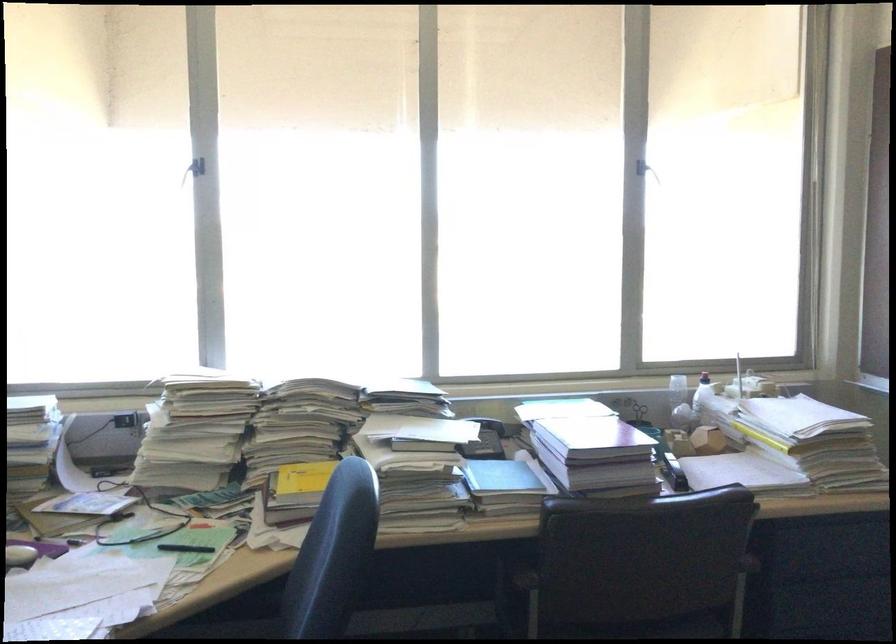
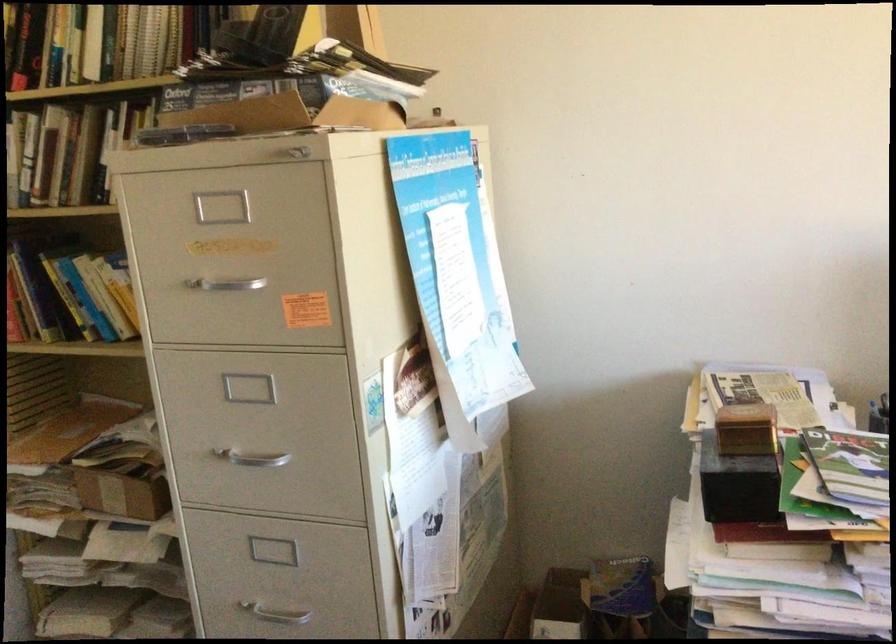
The first image is from the beginning of the video and the second image is from the end. How did the camera likely rotate when shooting the video?

The rotation direction of the camera is left-down.